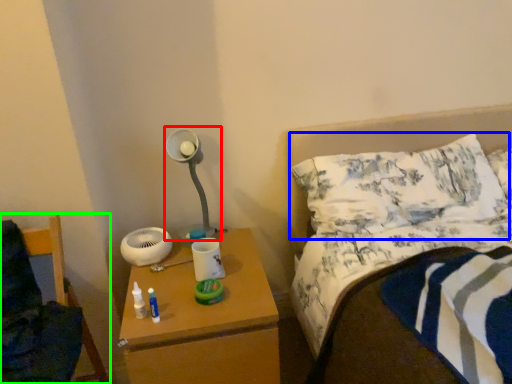
Question: Based on their relative distances, which object is farther from lamp (highlighted by a red box)? Choose from pillow (highlighted by a blue box) and furniture (highlighted by a green box).

Choices:
 (A) pillow
 (B) furniture

Answer: (A)